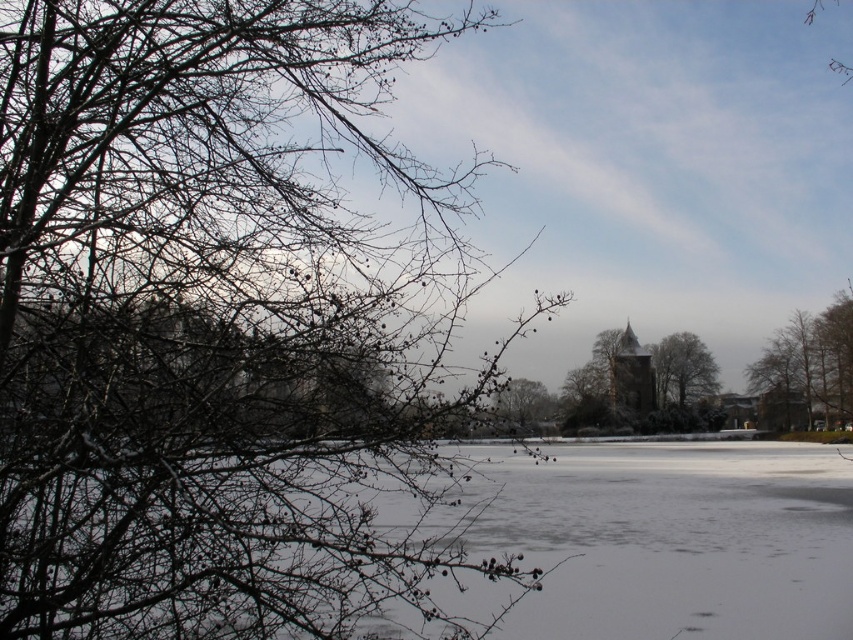
You are standing at the center of the frozen lake and want to reach the green leafy tree at right. Which direction should you head towards?

The green leafy tree at right is located at point (807, 371), so you should head towards the right side of the image to reach it.

You are an environmental scientist assessing the health of a forest. You observe the green leafy tree at right and the smooth brown tree at center in the winter scene. Which tree might indicate better health based on its height compared to the other?

The smooth brown tree at center is taller than the green leafy tree at right, suggesting it might be healthier as taller trees often indicate better growth and health.